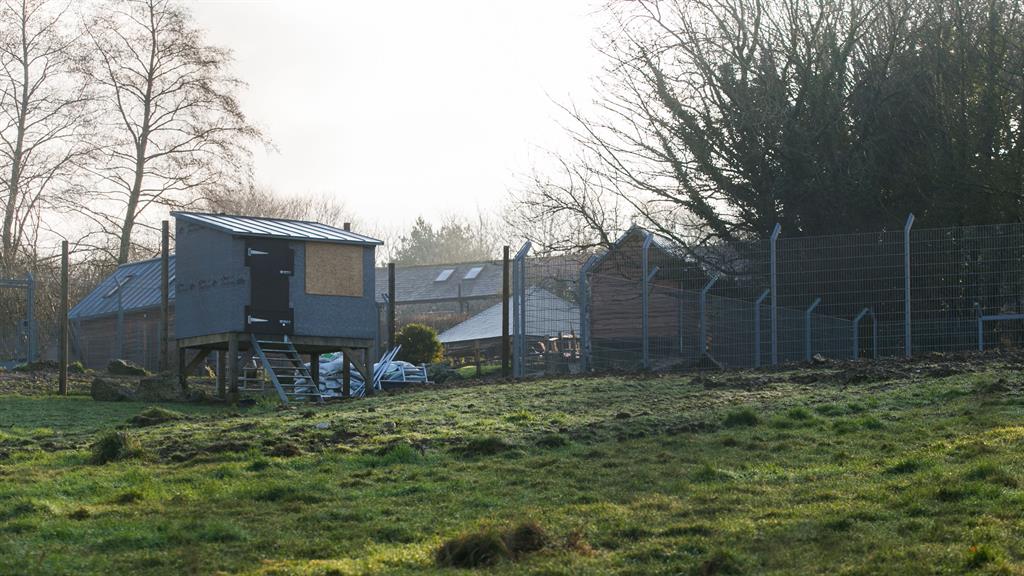
Image resolution: width=1024 pixels, height=576 pixels. I want to click on boarded up window, so click(x=330, y=268).